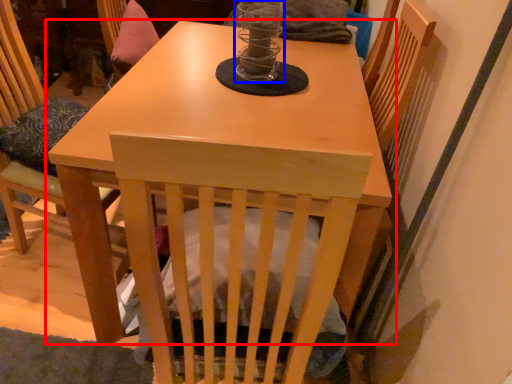
Question: Which object is closer to the camera taking this photo, table (highlighted by a red box) or candle holder (highlighted by a blue box)?

Choices:
 (A) table
 (B) candle holder

Answer: (A)